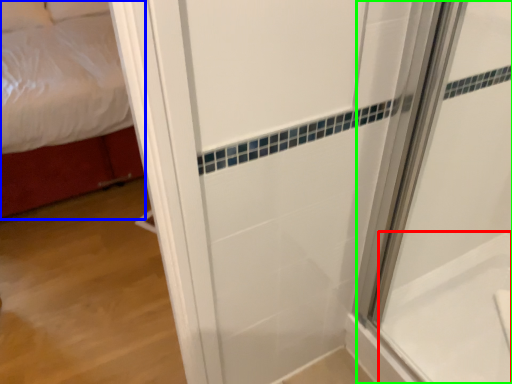
Question: Based on their relative distances, which object is farther from bath (highlighted by a red box)? Choose from bed (highlighted by a blue box) and shower door (highlighted by a green box).

Choices:
 (A) bed
 (B) shower door

Answer: (A)